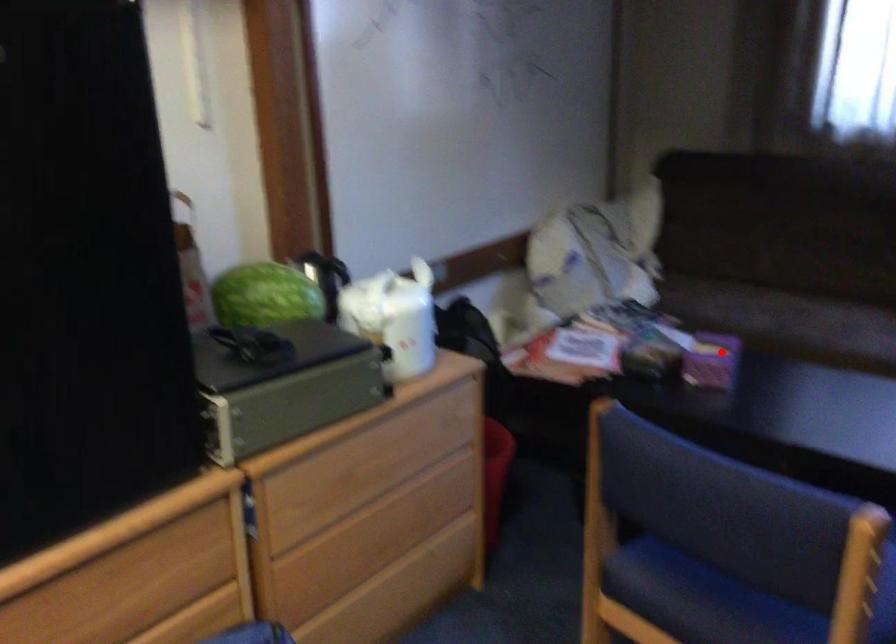
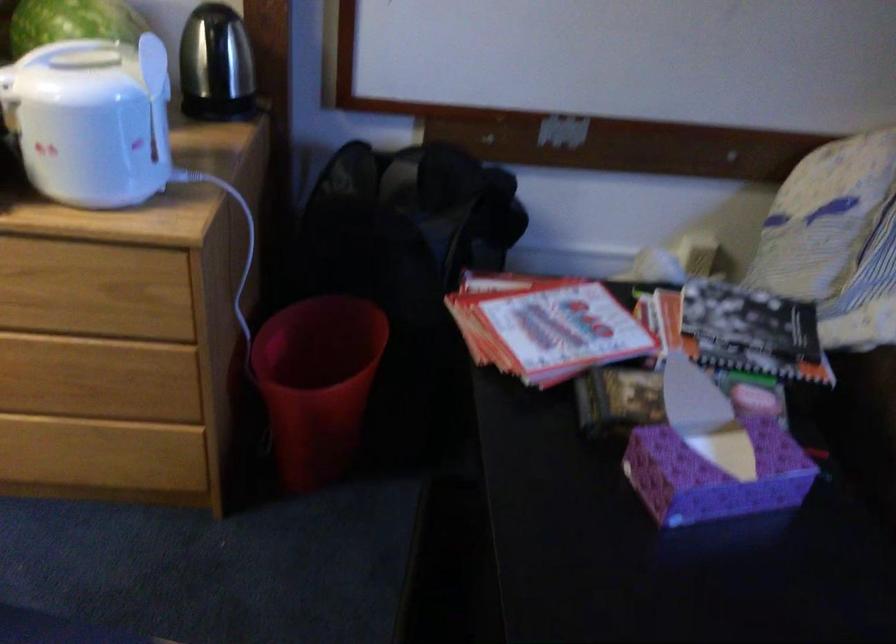
Question: I am providing you with two images of the same scene from different viewpoints. Image1 has a red point marked. In image2, the corresponding 3D location appears at what relative position? Reply with the corresponding letter.

Choices:
 (A) Closer
 (B) Farther

Answer: (A)